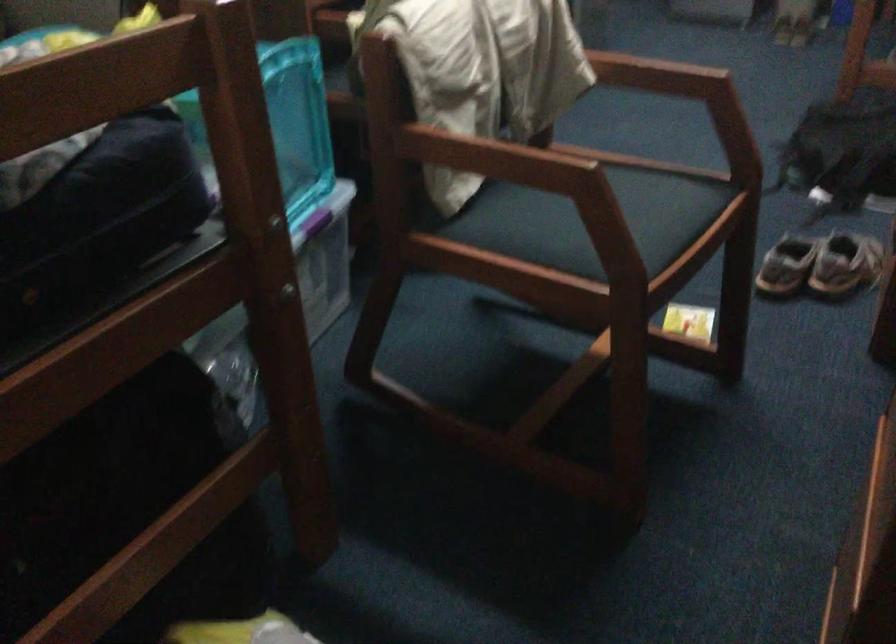
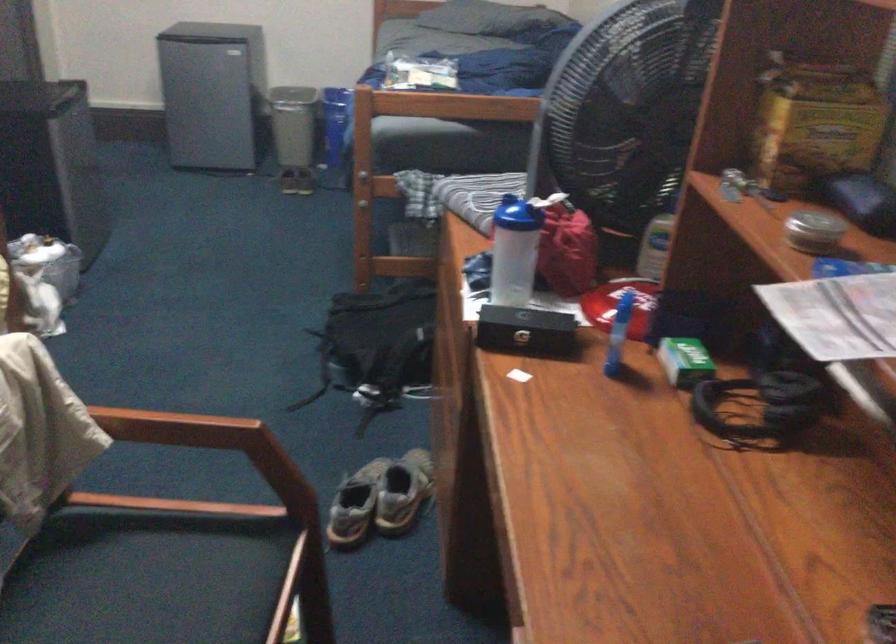
Locate, in the second image, the point that corresponds to pixel 790 268 in the first image.

(355, 505)